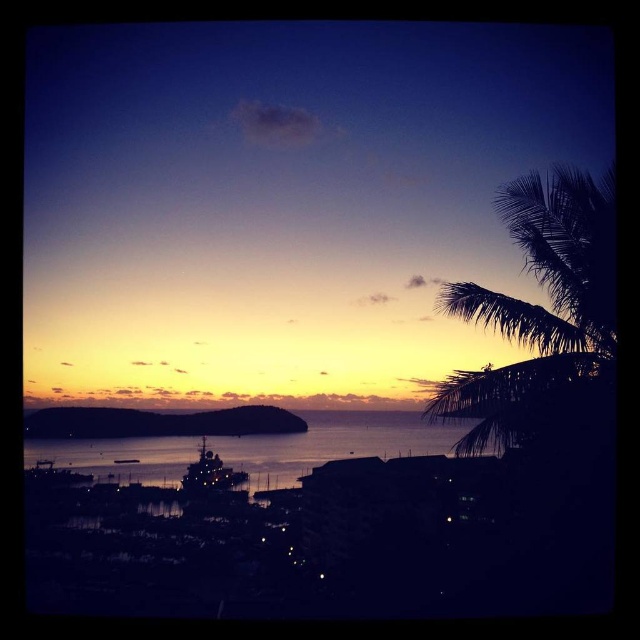
In the scene shown: You are standing on the beach looking at the sunset. You see the silhouette leafy palm at right and the glistening water at center. Which object is positioned to the right of the other?

The silhouette leafy palm at right is to the right of the glistening water at center.

You are standing at the point closer to the viewer between point (365,413) and point (216,465). Which point are you at?

You are at point (365,413) because it is closer to the viewer than point (216,465).